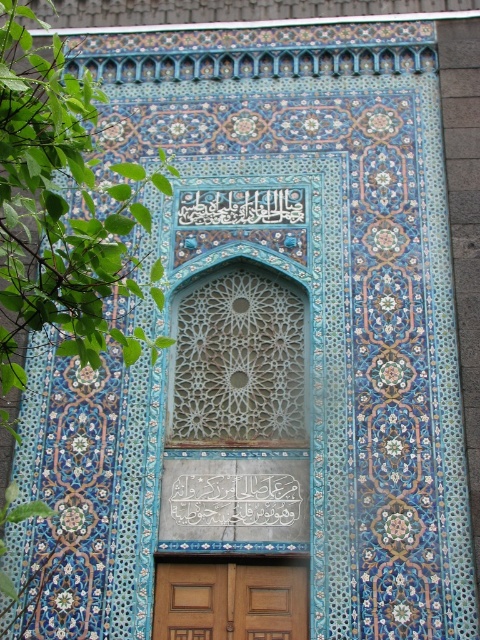
Looking at this image, can you confirm if wooden panelled door at lower center is thinner than white stone writing at center?

Yes.

Between wooden panelled door at lower center and white stone writing at center, which one is positioned lower?

wooden panelled door at lower center is below.

Which is behind, point (225, 602) or point (290, 484)?

The point (290, 484) is more distant.

Identify the location of wooden panelled door at lower center. (229, 602).

Which is more to the left, white stone writing at center or white calligraphy at center?

From the viewer's perspective, white calligraphy at center appears more on the left side.

Is white stone writing at center closer to camera compared to white calligraphy at center?

Yes.

You are a GUI agent. You are given a task and a screenshot of the screen. Output one action in this format:
    pyautogui.click(x=<x>, y=<y>)
    Task: Click on the white stone writing at center
    The image size is (480, 640).
    Given the screenshot: What is the action you would take?
    pyautogui.click(x=237, y=499)

Is wooden panelled door at lower center thinner than white calligraphy at center?

In fact, wooden panelled door at lower center might be wider than white calligraphy at center.

Which is below, wooden panelled door at lower center or white calligraphy at center?

Positioned lower is wooden panelled door at lower center.

Find the location of `wooden panelled door at lower center`. wooden panelled door at lower center is located at coordinates (229, 602).

Where is `wooden panelled door at lower center`? The width and height of the screenshot is (480, 640). wooden panelled door at lower center is located at coordinates (229, 602).